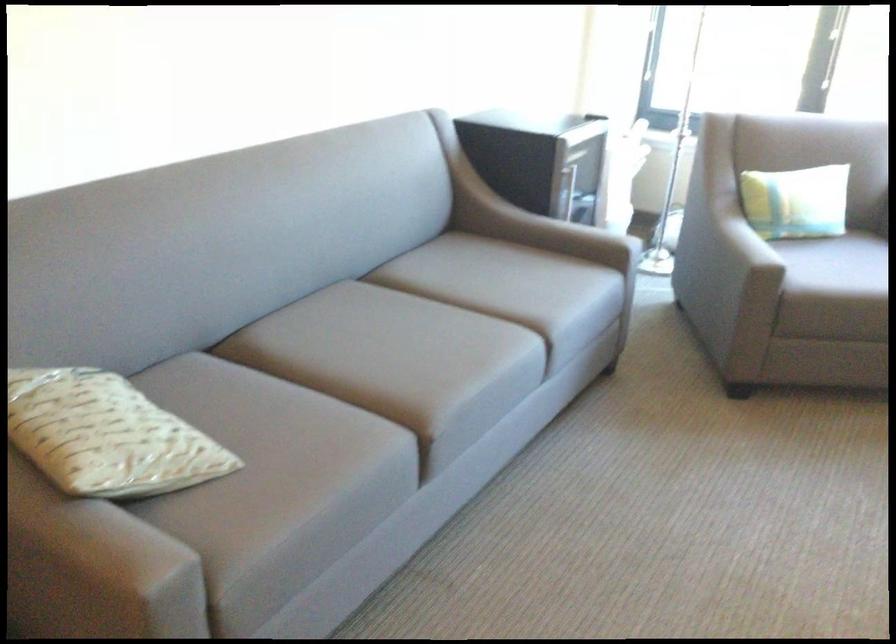
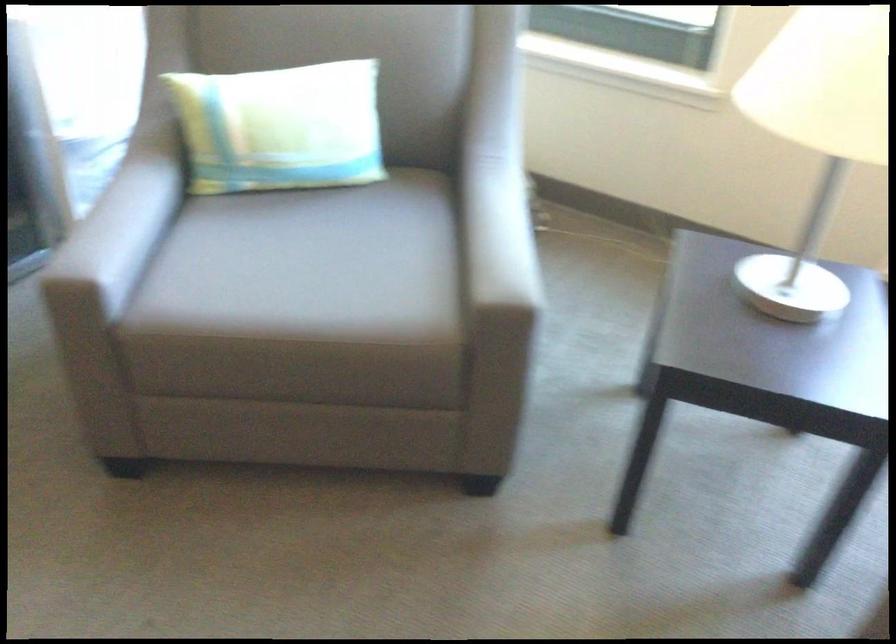
Which direction would the cameraman need to move to produce the second image?

The cameraman moved toward right, forward.